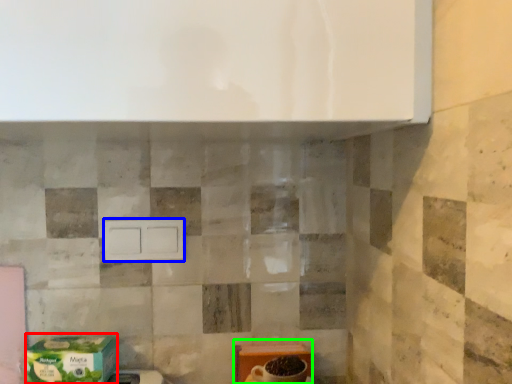
Question: Considering the real-world distances, which object is farthest from cardboard box (highlighted by a red box)? drawer (highlighted by a blue box) or cardboard box (highlighted by a green box)?

Choices:
 (A) drawer
 (B) cardboard box

Answer: (B)